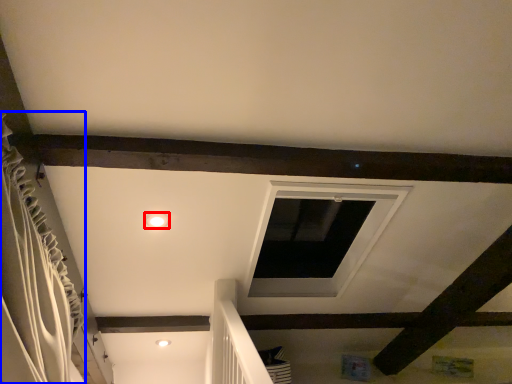
Question: Which object is closer to the camera taking this photo, lighting (highlighted by a red box) or curtain (highlighted by a blue box)?

Choices:
 (A) lighting
 (B) curtain

Answer: (B)